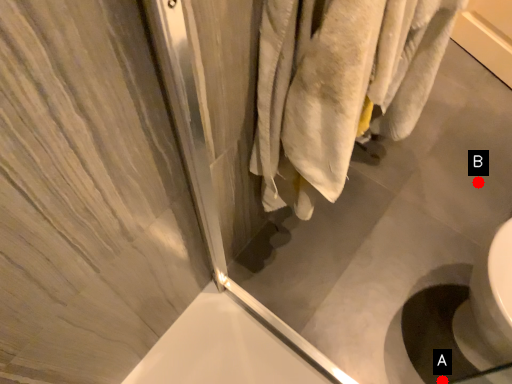
Question: Two points are circled on the image, labeled by A and B beside each circle. Which point is closer to the camera?

Choices:
 (A) A is closer
 (B) B is closer

Answer: (A)